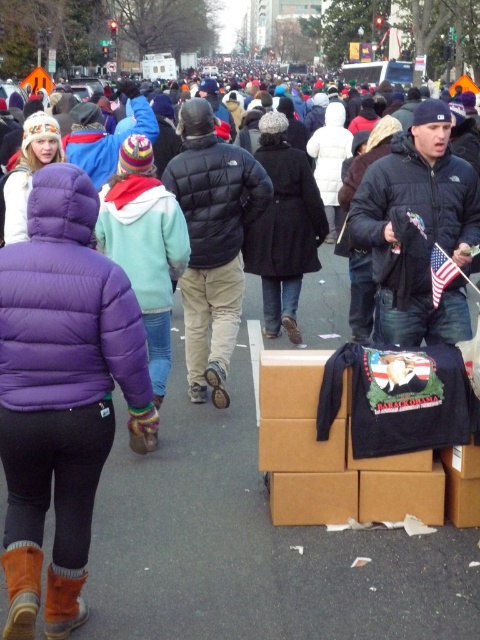
Does point (56, 477) come behind point (346, 353)?

No, (56, 477) is in front of (346, 353).

Locate an element on the screen. purple puffy jacket at left is located at coordinates (61, 392).

Does black matte jacket at center come in front of black puffy jacket at center?

That is True.

The image size is (480, 640). I want to click on black matte jacket at center, so click(420, 227).

How much distance is there between brown cardboard boxes at lower right and black puffy jacket at center?

They are 1.79 meters apart.

Is brown cardboard boxes at lower right in front of black puffy jacket at center?

Yes, it is in front of black puffy jacket at center.

Image resolution: width=480 pixels, height=640 pixels. I want to click on brown cardboard boxes at lower right, so click(360, 432).